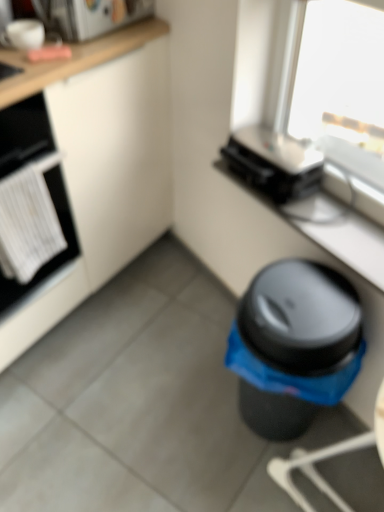
Question: From the image's perspective, is white matte cabinet at lower left beneath matte black toaster at upper right?

Choices:
 (A) yes
 (B) no

Answer: (B)

Question: Is white matte cabinet at lower left positioned with its back to matte black toaster at upper right?

Choices:
 (A) no
 (B) yes

Answer: (A)

Question: Is white matte cabinet at lower left to the right of matte black toaster at upper right from the viewer's perspective?

Choices:
 (A) yes
 (B) no

Answer: (B)

Question: Does white matte cabinet at lower left have a lesser height compared to matte black toaster at upper right?

Choices:
 (A) yes
 (B) no

Answer: (B)

Question: Would you say white matte cabinet at lower left is outside matte black toaster at upper right?

Choices:
 (A) yes
 (B) no

Answer: (A)

Question: Is matte black toaster at upper right spatially inside black plastic toaster at upper center, arranged as the first appliance when ordered from the bottom, or outside of it?

Choices:
 (A) outside
 (B) inside

Answer: (A)

Question: From a real-world perspective, relative to black plastic toaster at upper center, which is counted as the second appliance, starting from the top, is matte black toaster at upper right vertically above or below?

Choices:
 (A) below
 (B) above

Answer: (A)

Question: Considering the relative positions of matte black toaster at upper right and black plastic toaster at upper center, acting as the 1th appliance starting from the right, in the image provided, is matte black toaster at upper right to the left or to the right of black plastic toaster at upper center, acting as the 1th appliance starting from the right,?

Choices:
 (A) left
 (B) right

Answer: (B)

Question: Is point (321, 211) positioned closer to the camera than point (230, 164)?

Choices:
 (A) closer
 (B) farther

Answer: (A)

Question: Is white matte cabinet at lower left wider or thinner than black plastic toaster at upper center, which ranks as the 2th appliance in left-to-right order?

Choices:
 (A) wide
 (B) thin

Answer: (A)

Question: Choose the correct answer: Is white matte cabinet at lower left inside black plastic toaster at upper center, which is counted as the second appliance, starting from the top, or outside it?

Choices:
 (A) inside
 (B) outside

Answer: (B)

Question: Based on their positions, is white matte cabinet at lower left located to the left or right of black plastic toaster at upper center, acting as the 1th appliance starting from the right?

Choices:
 (A) right
 (B) left

Answer: (B)

Question: Is white matte cabinet at lower left taller or shorter than black plastic toaster at upper center, acting as the 1th appliance starting from the right?

Choices:
 (A) short
 (B) tall

Answer: (B)

Question: In the image, is white matte cabinet at lower left positioned in front of or behind white matte oven at left?

Choices:
 (A) front
 (B) behind

Answer: (A)

Question: From the image's perspective, is white matte cabinet at lower left above or below white matte oven at left?

Choices:
 (A) above
 (B) below

Answer: (A)